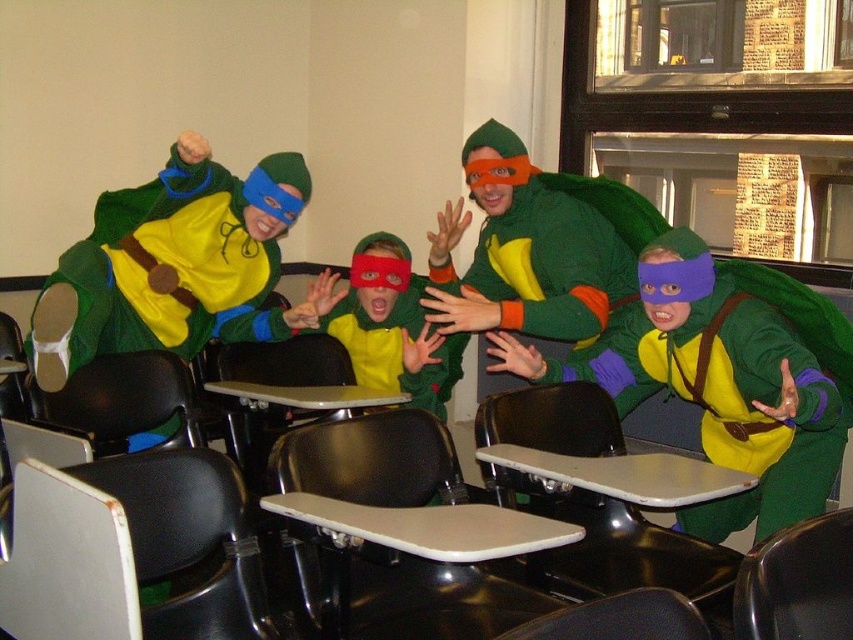
Which is in front, point (206, 241) or point (257, 433)?

Positioned in front is point (206, 241).

Is matte green costume at left further to the viewer compared to smooth plastic table at center?

No, it is in front of smooth plastic table at center.

The width and height of the screenshot is (853, 640). What are the coordinates of `matte green costume at left` in the screenshot? It's located at (172, 262).

Can you confirm if matte green turtle costume at center is smaller than smooth plastic table at center?

Actually, matte green turtle costume at center might be larger than smooth plastic table at center.

Between matte green turtle costume at center and smooth plastic table at center, which one appears on the right side from the viewer's perspective?

Positioned to the right is matte green turtle costume at center.

Is point (802, 518) behind point (352, 401)?

That is False.

Where is `matte green turtle costume at center`? matte green turtle costume at center is located at coordinates (717, 385).

Can you confirm if matte green costume at center is shorter than smooth beige table at center?

No, matte green costume at center is not shorter than smooth beige table at center.

Does matte green costume at center appear over smooth beige table at center?

Correct, matte green costume at center is located above smooth beige table at center.

The height and width of the screenshot is (640, 853). In order to click on matte green costume at center in this screenshot , I will do click(x=386, y=324).